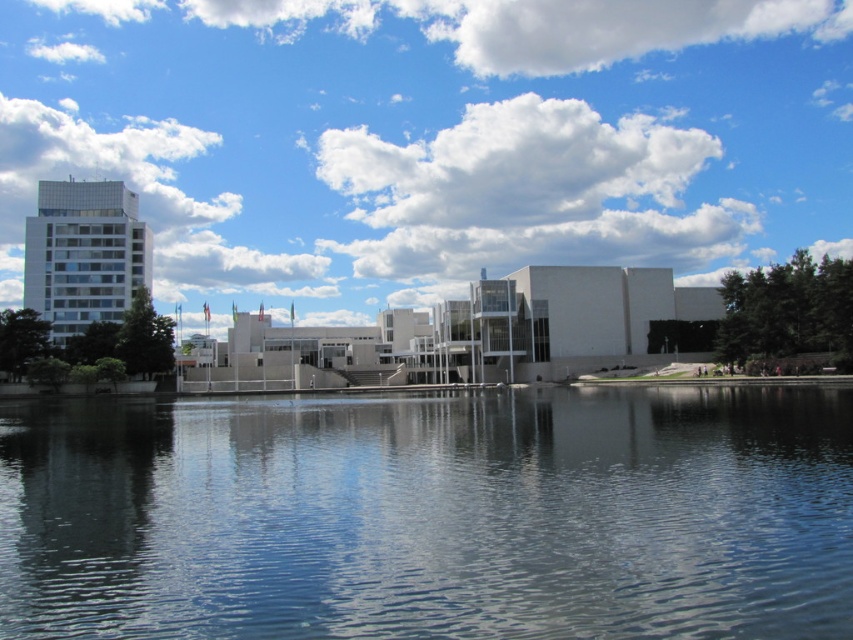
Question: Can you confirm if clear blue water at center is wider than white fluffy cloud at upper center?

Choices:
 (A) no
 (B) yes

Answer: (A)

Question: Does clear blue water at center lie behind white fluffy cloud at upper center?

Choices:
 (A) yes
 (B) no

Answer: (B)

Question: Among these objects, which one is nearest to the camera?

Choices:
 (A) white fluffy cloud at upper center
 (B) clear blue water at center

Answer: (B)

Question: Is clear blue water at center further to the viewer compared to white fluffy cloud at upper center?

Choices:
 (A) no
 (B) yes

Answer: (A)

Question: Among these objects, which one is nearest to the camera?

Choices:
 (A) clear blue water at center
 (B) white fluffy cloud at upper center

Answer: (A)

Question: Among these objects, which one is nearest to the camera?

Choices:
 (A) clear blue water at center
 (B) white fluffy cloud at upper center

Answer: (A)